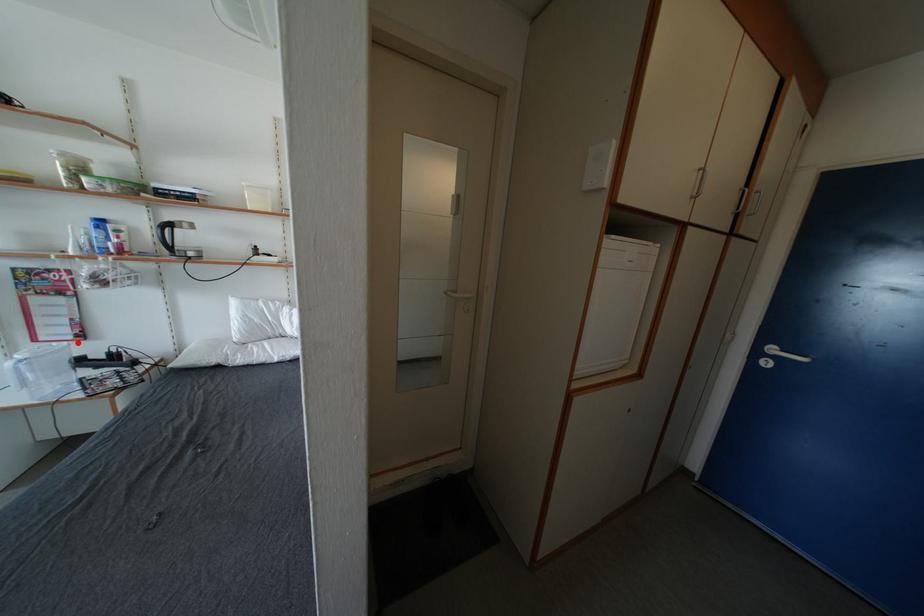
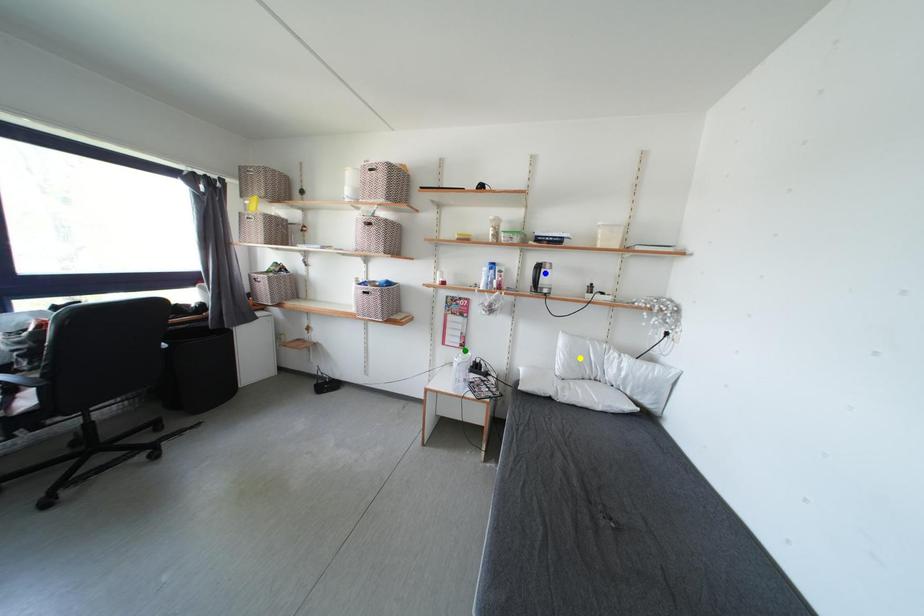
Question: I am providing you with two images of the same scene from different viewpoints. A red point is marked on the first image. You are given multiple points on the second image. Which mark in image 2 goes with the point in image 1?

Choices:
 (A) green point
 (B) blue point
 (C) yellow point

Answer: (A)